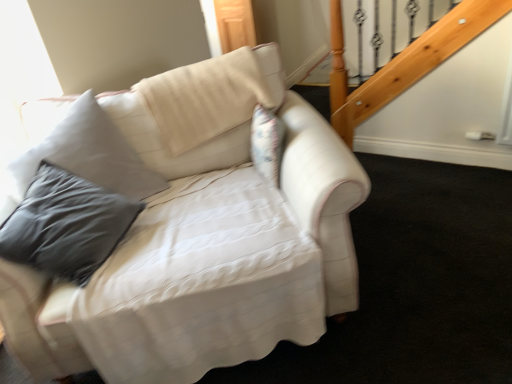
Question: Considering their positions, is beige fabric pillow at upper center located in front of or behind white fabric couch at center?

Choices:
 (A) behind
 (B) front

Answer: (A)

Question: Is beige fabric pillow at upper center wider or thinner than white fabric couch at center?

Choices:
 (A) thin
 (B) wide

Answer: (A)

Question: Does point (231, 120) appear closer or farther from the camera than point (245, 281)?

Choices:
 (A) closer
 (B) farther

Answer: (B)

Question: Is point (137, 296) positioned closer to the camera than point (244, 49)?

Choices:
 (A) closer
 (B) farther

Answer: (A)

Question: Considering the positions of white fabric couch at center and beige fabric pillow at upper center in the image, is white fabric couch at center wider or thinner than beige fabric pillow at upper center?

Choices:
 (A) thin
 (B) wide

Answer: (B)

Question: In the image, is white fabric couch at center positioned in front of or behind beige fabric pillow at upper center?

Choices:
 (A) front
 (B) behind

Answer: (A)

Question: In terms of size, does white fabric couch at center appear bigger or smaller than beige fabric pillow at upper center?

Choices:
 (A) big
 (B) small

Answer: (A)